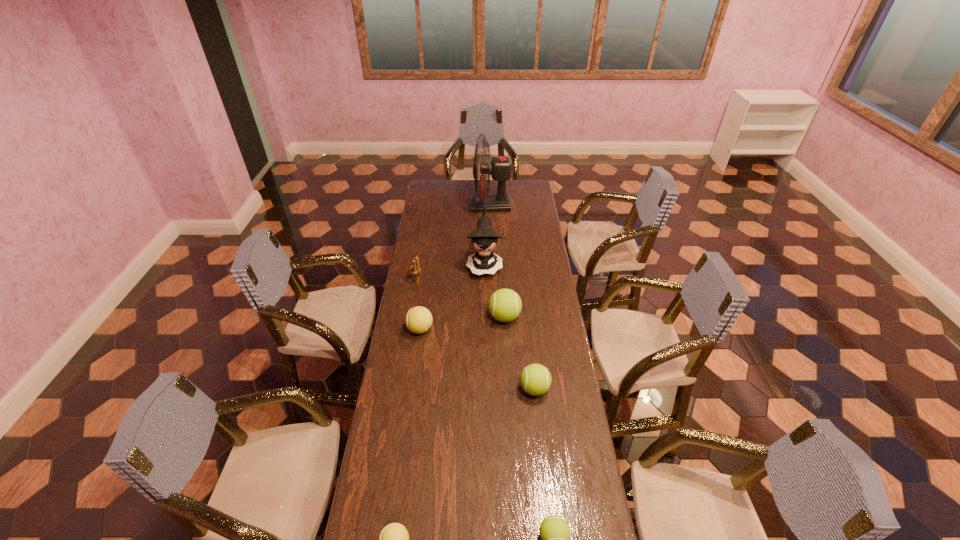
The image size is (960, 540). What are the coordinates of `the farthest object` in the screenshot? It's located at click(500, 167).

I want to click on the tallest object, so click(500, 167).

At what (x,y) coordinates should I click in order to perform the action: click on the seventh shortest object. Please return your answer as a coordinate pair (x, y). This screenshot has width=960, height=540. Looking at the image, I should click on (484, 238).

The image size is (960, 540). Find the location of `candle holder`. candle holder is located at coordinates (415, 268).

Find the location of a particular element. The width and height of the screenshot is (960, 540). the farthest green tennis ball is located at coordinates (505, 305).

Locate an element on the screen. The image size is (960, 540). the tallest tennis ball is located at coordinates (505, 305).

The height and width of the screenshot is (540, 960). Find the location of `the third farthest tennis ball`. the third farthest tennis ball is located at coordinates (535, 379).

At what (x,y) coordinates should I click in order to perform the action: click on the third nearest object. Please return your answer as a coordinate pair (x, y). The width and height of the screenshot is (960, 540). Looking at the image, I should click on (535, 379).

Locate an element on the screen. Image resolution: width=960 pixels, height=540 pixels. the farther yellow tennis ball is located at coordinates (418, 320).

Identify the location of free space located 0.140m on the front-facing side of the fan. This screenshot has height=540, width=960. (447, 206).